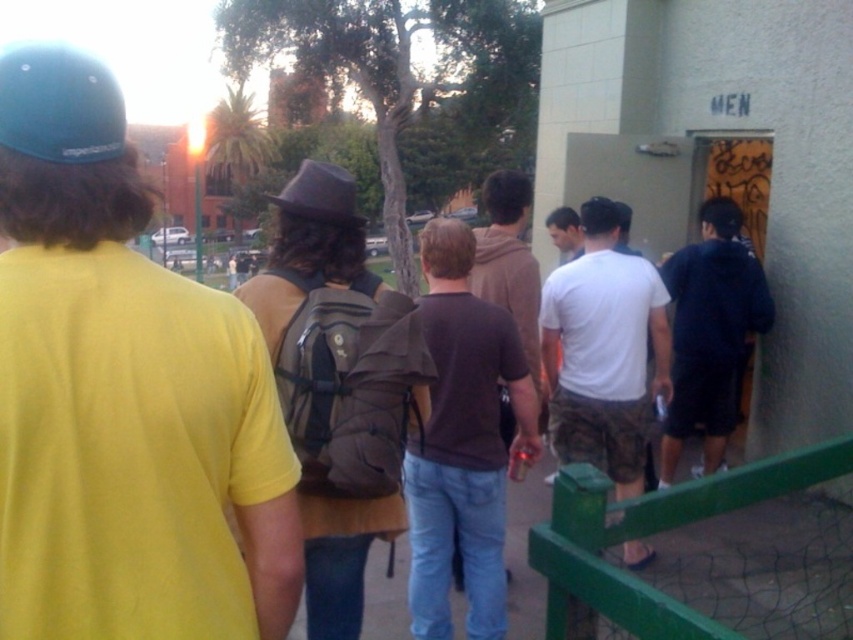
Question: Which point is farther to the camera?

Choices:
 (A) (596, 561)
 (B) (155, 506)
 (C) (53, 157)

Answer: (A)

Question: Is green painted metal fence at lower right smaller than brown felt hat at center?

Choices:
 (A) yes
 (B) no

Answer: (A)

Question: Is dark blue hoodie at center in front of brown felt hat at center?

Choices:
 (A) no
 (B) yes

Answer: (A)

Question: Does brown matte shirt at center have a smaller size compared to teal matte baseball hat at upper left?

Choices:
 (A) yes
 (B) no

Answer: (B)

Question: Which point appears farthest from the camera in this image?

Choices:
 (A) (434, 252)
 (B) (115, 150)
 (C) (279, 616)
 (D) (305, 198)

Answer: (A)

Question: Which object is closer to the camera taking this photo?

Choices:
 (A) brown felt hat at center
 (B) dark blue hoodie at center

Answer: (A)